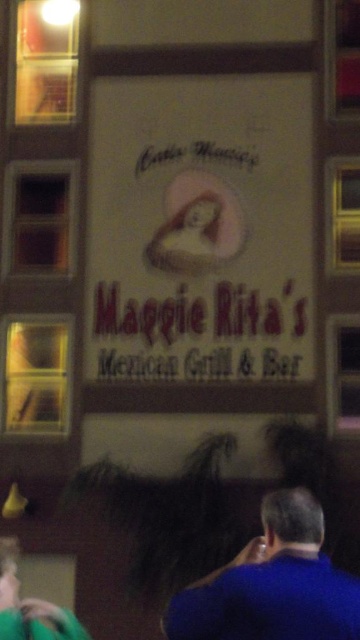
You are standing in front of the Maggie Rita Mexican Grill and Bar sign. There is a point marked at coordinates (200,228). What is located at that point on the sign?

The point at (200,228) marks the location of the white paper sign at center.

You are a customer entering Maggie Rita Mexican Grill and Bar and you see both the white paper sign at center and the blue fabric shirt at lower right. Which object is closer to you?

The white paper sign at center is closer to you because the blue fabric shirt at lower right is behind it.